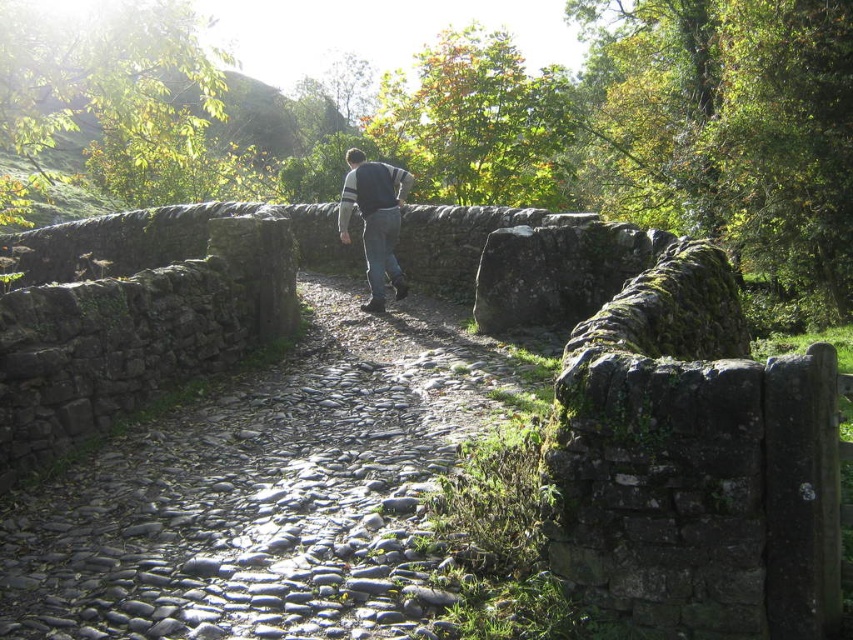
Who is taller, gray cobblestone trail at center or dark gray sweater at center?

Standing taller between the two is dark gray sweater at center.

Does gray cobblestone trail at center have a smaller size compared to dark gray sweater at center?

Correct, gray cobblestone trail at center occupies less space than dark gray sweater at center.

Which is in front, point (177, 468) or point (354, 156)?

Point (177, 468) is more forward.

I want to click on gray cobblestone trail at center, so click(x=265, y=493).